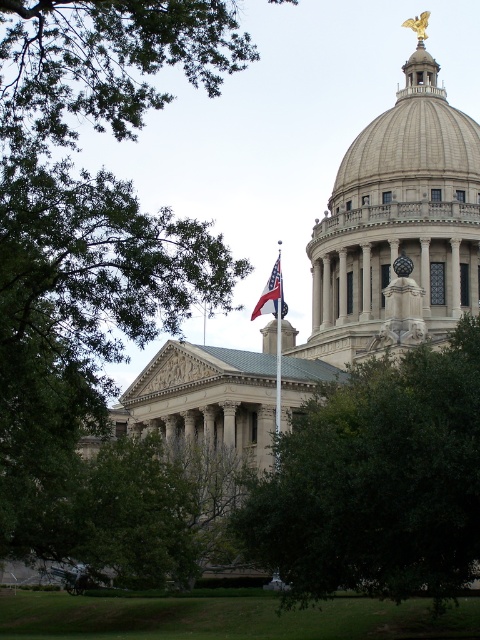
Question: Is green leafy tree at center wider than green leafy tree at upper left?

Choices:
 (A) no
 (B) yes

Answer: (A)

Question: Can you confirm if green leafy tree at upper left is smaller than american flag at center?

Choices:
 (A) yes
 (B) no

Answer: (B)

Question: Is green leafy tree at upper left to the left of american flag at center from the viewer's perspective?

Choices:
 (A) no
 (B) yes

Answer: (B)

Question: Among these points, which one is nearest to the camera?

Choices:
 (A) (388, 596)
 (B) (22, 72)
 (C) (277, 394)
 (D) (278, 259)

Answer: (B)

Question: Estimate the real-world distances between objects in this image. Which object is closer to the american flag at center?

Choices:
 (A) green leafy tree at upper left
 (B) green leafy tree at center
 (C) polished metal flag pole at center

Answer: (C)

Question: Which point is closer to the camera taking this photo?

Choices:
 (A) (476, 321)
 (B) (279, 353)

Answer: (A)